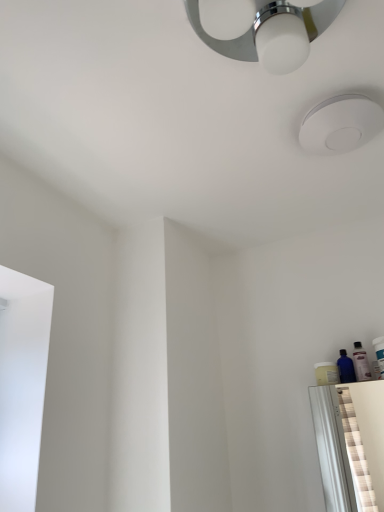
Question: From a real-world perspective, is white matte droplight at upper center physically below white plastic toothbrush at right, which is the 1th toiletry in right-to-left order?

Choices:
 (A) yes
 (B) no

Answer: (B)

Question: Is white matte droplight at upper center further to camera compared to white plastic toothbrush at right, which is the 1th toiletry in right-to-left order?

Choices:
 (A) yes
 (B) no

Answer: (B)

Question: Is white matte droplight at upper center beside white plastic toothbrush at right, which is the 1th toiletry in right-to-left order?

Choices:
 (A) yes
 (B) no

Answer: (B)

Question: Is white matte droplight at upper center at the right side of white plastic toothbrush at right, which is the 1th toiletry in right-to-left order?

Choices:
 (A) yes
 (B) no

Answer: (B)

Question: Is white matte droplight at upper center wider than white plastic toothbrush at right, which ranks as the second toiletry in left-to-right order?

Choices:
 (A) yes
 (B) no

Answer: (A)

Question: From a real-world perspective, is translucent plastic bottle at right, acting as the 2th toiletry starting from the right, positioned above or below transparent plastic bottle at right?

Choices:
 (A) above
 (B) below

Answer: (A)

Question: Based on their positions, is translucent plastic bottle at right, acting as the 2th toiletry starting from the right, located to the left or right of transparent plastic bottle at right?

Choices:
 (A) right
 (B) left

Answer: (A)

Question: From their relative heights in the image, would you say translucent plastic bottle at right, acting as the 2th toiletry starting from the right, is taller or shorter than transparent plastic bottle at right?

Choices:
 (A) tall
 (B) short

Answer: (A)

Question: From the image's perspective, relative to transparent plastic bottle at right, is translucent plastic bottle at right, acting as the 2th toiletry starting from the right, above or below?

Choices:
 (A) below
 (B) above

Answer: (B)

Question: Based on their sizes in the image, would you say translucent plastic bottle at right, acting as the 2th toiletry starting from the right, is bigger or smaller than white matte droplight at upper center?

Choices:
 (A) big
 (B) small

Answer: (B)

Question: Based on their positions, is translucent plastic bottle at right, the 1th toiletry positioned from the left, located to the left or right of white matte droplight at upper center?

Choices:
 (A) right
 (B) left

Answer: (A)

Question: In the image, is translucent plastic bottle at right, acting as the 2th toiletry starting from the right, positioned in front of or behind white matte droplight at upper center?

Choices:
 (A) front
 (B) behind

Answer: (B)

Question: In terms of width, does translucent plastic bottle at right, the 1th toiletry positioned from the left, look wider or thinner when compared to white matte droplight at upper center?

Choices:
 (A) wide
 (B) thin

Answer: (B)

Question: From the image's perspective, relative to white matte droplight at upper center, is white plastic toothbrush at right, which is the 1th toiletry in right-to-left order, above or below?

Choices:
 (A) above
 (B) below

Answer: (B)

Question: Is white plastic toothbrush at right, which is the 1th toiletry in right-to-left order, in front of or behind white matte droplight at upper center in the image?

Choices:
 (A) front
 (B) behind

Answer: (B)